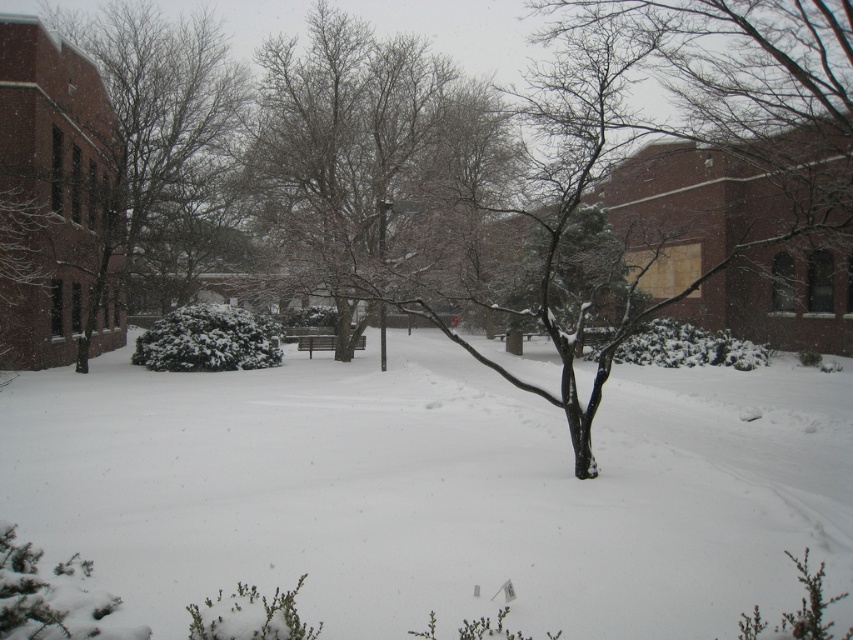
Does white fluffy snow at center appear over snow-covered tree at left?

Actually, white fluffy snow at center is below snow-covered tree at left.

Is white fluffy snow at center below snow-covered tree at left?

Correct, white fluffy snow at center is located below snow-covered tree at left.

This screenshot has width=853, height=640. Describe the element at coordinates (437, 490) in the screenshot. I see `white fluffy snow at center` at that location.

Identify the location of white fluffy snow at center. Image resolution: width=853 pixels, height=640 pixels. (437, 490).

Measure the distance between point (24, 19) and camera.

The distance of point (24, 19) from camera is 74.71 feet.

You are a GUI agent. You are given a task and a screenshot of the screen. Output one action in this format:
    pyautogui.click(x=<x>, y=<y>)
    Task: Click on the snow-covered tree at left
    The width and height of the screenshot is (853, 640).
    Given the screenshot: What is the action you would take?
    pyautogui.click(x=108, y=170)

What do you see at coordinates (108, 170) in the screenshot? I see `snow-covered tree at left` at bounding box center [108, 170].

Where is `snow-covered tree at left`? The height and width of the screenshot is (640, 853). snow-covered tree at left is located at coordinates (108, 170).

Can you confirm if white fluffy snow at center is positioned to the right of snow-covered tree at center?

Indeed, white fluffy snow at center is positioned on the right side of snow-covered tree at center.

Based on the photo, does white fluffy snow at center appear on the left side of snow-covered tree at center?

In fact, white fluffy snow at center is to the right of snow-covered tree at center.

Who is more distant from viewer, (206, 388) or (317, 96)?

Positioned behind is point (317, 96).

Find the location of a particular element. This screenshot has width=853, height=640. white fluffy snow at center is located at coordinates (437, 490).